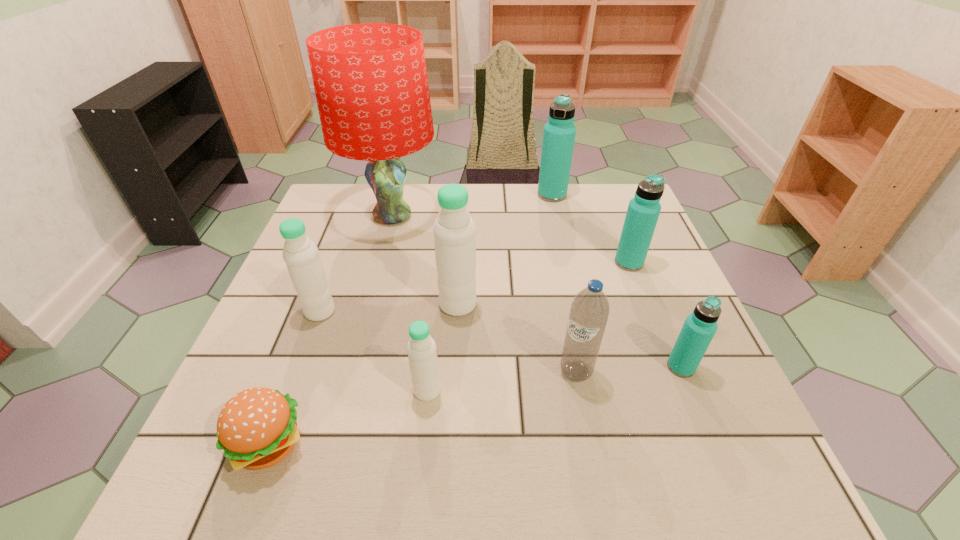
At what (x,y) coordinates should I click in order to perform the action: click on hamburger. Please return your answer as a coordinate pair (x, y). The height and width of the screenshot is (540, 960). Looking at the image, I should click on (257, 428).

At what (x,y) coordinates should I click in order to perform the action: click on the nearest object. Please return your answer as a coordinate pair (x, y). The height and width of the screenshot is (540, 960). Looking at the image, I should click on (257, 428).

Where is `vacant space located on the front-facing side of the lampshade`? Image resolution: width=960 pixels, height=540 pixels. vacant space located on the front-facing side of the lampshade is located at coordinates (380, 262).

Find the location of a particular element. vacant area situated on the front of the farthest water bottle is located at coordinates (565, 253).

The height and width of the screenshot is (540, 960). Identify the location of free spot located 0.050m on the front of the biggest white water bottle. (456, 335).

At what (x,y) coordinates should I click in order to perform the action: click on free location located on the back of the third farthest object. Please return your answer as a coordinate pair (x, y). This screenshot has width=960, height=540. Looking at the image, I should click on (616, 231).

This screenshot has height=540, width=960. I want to click on free space located 0.090m on the right of the leftmost water bottle, so pyautogui.click(x=375, y=312).

Find the location of a particular element. The image size is (960, 540). vacant space located 0.220m on the left of the smallest blue water bottle is located at coordinates (557, 367).

The height and width of the screenshot is (540, 960). Find the location of `free space located 0.370m on the back of the smallest white water bottle`. free space located 0.370m on the back of the smallest white water bottle is located at coordinates (441, 258).

At what (x,y) coordinates should I click in order to perform the action: click on vacant space located on the right of the hamburger. Please return your answer as a coordinate pair (x, y). Image resolution: width=960 pixels, height=540 pixels. Looking at the image, I should click on (466, 445).